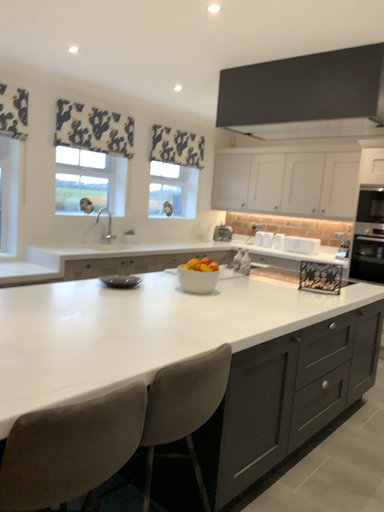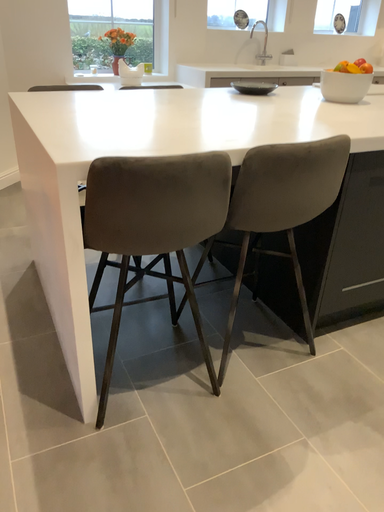
Question: Which way did the camera rotate in the video?

Choices:
 (A) rotated downward
 (B) rotated upward

Answer: (A)